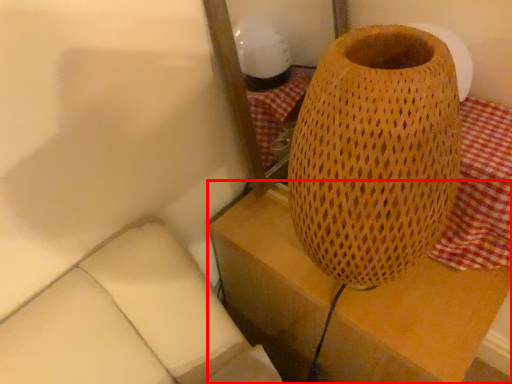
Question: From the image's perspective, what is the correct spatial relationship of furniture (annotated by the red box) in relation to tablecloth?

Choices:
 (A) below
 (B) above

Answer: (A)